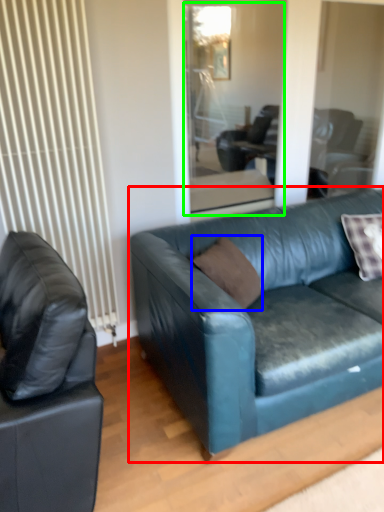
Question: Which is farther away from studio couch (highlighted by a red box)? pillow (highlighted by a blue box) or glass door (highlighted by a green box)?

Choices:
 (A) pillow
 (B) glass door

Answer: (B)